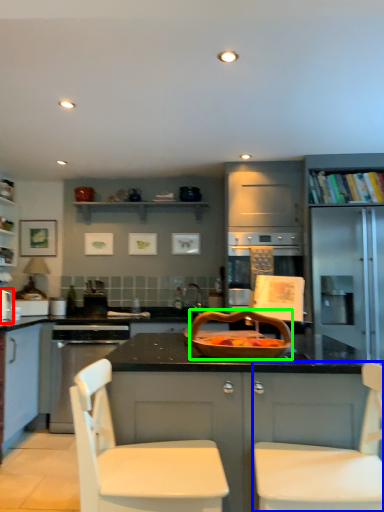
Question: Which object is the farthest from appliance (highlighted by a red box)? Choose among these: chair (highlighted by a blue box) or basket (highlighted by a green box).

Choices:
 (A) chair
 (B) basket

Answer: (A)